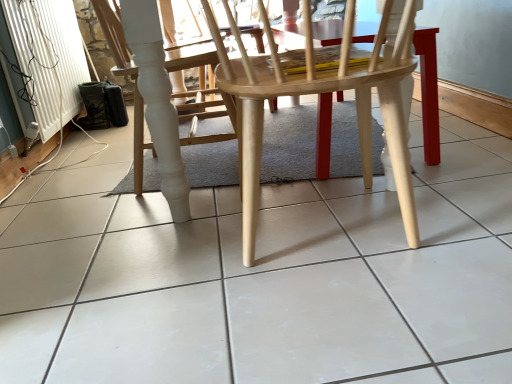
What are the coordinates of `empty space that is to the right of natural wood chair at center, the first chair viewed from the front` in the screenshot? It's located at (460, 198).